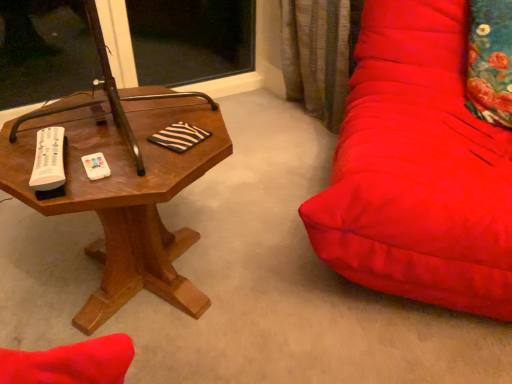
Find the location of a particular element. The width and height of the screenshot is (512, 384). vacant space underneath woodenobject at left (from a real-world perspective) is located at coordinates (147, 290).